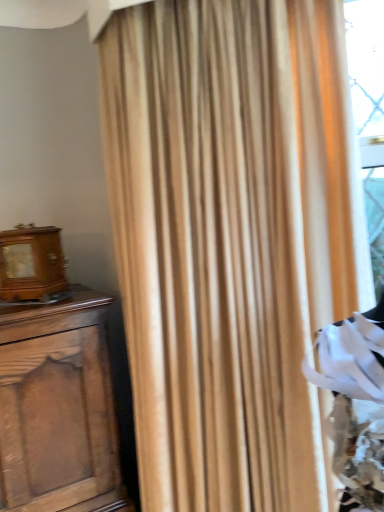
Identify the location of wooden alarm clock at left. The image size is (384, 512). (31, 264).

Image resolution: width=384 pixels, height=512 pixels. What do you see at coordinates (31, 264) in the screenshot?
I see `wooden alarm clock at left` at bounding box center [31, 264].

At what (x,y) coordinates should I click in order to perform the action: click on matte beige curtain at center. Please return your answer as a coordinate pair (x, y). Looking at the image, I should click on (226, 241).

What do you see at coordinates (226, 241) in the screenshot? Image resolution: width=384 pixels, height=512 pixels. I see `matte beige curtain at center` at bounding box center [226, 241].

The image size is (384, 512). I want to click on wooden alarm clock at left, so (31, 264).

Is wooden alarm clock at left to the left of matte beige curtain at center from the viewer's perspective?

Indeed, wooden alarm clock at left is positioned on the left side of matte beige curtain at center.

Who is more distant, wooden alarm clock at left or matte beige curtain at center?

wooden alarm clock at left.

Does point (54, 288) come behind point (182, 302)?

Yes, it is.

From the image's perspective, is wooden alarm clock at left beneath matte beige curtain at center?

No, from the image's perspective, wooden alarm clock at left is not beneath matte beige curtain at center.

From a real-world perspective, is wooden alarm clock at left on matte beige curtain at center?

Yes, from a real-world perspective, wooden alarm clock at left is above matte beige curtain at center.

Which of these two, wooden alarm clock at left or matte beige curtain at center, is thinner?

wooden alarm clock at left is thinner.

From the picture: Does wooden alarm clock at left have a greater height compared to matte beige curtain at center?

No.

Considering the relative sizes of wooden alarm clock at left and matte beige curtain at center in the image provided, is wooden alarm clock at left bigger than matte beige curtain at center?

No, wooden alarm clock at left is not bigger than matte beige curtain at center.

Can we say wooden alarm clock at left lies outside matte beige curtain at center?

Yes, wooden alarm clock at left is located beyond the bounds of matte beige curtain at center.

Consider the image. Are wooden alarm clock at left and matte beige curtain at center far apart?

No, there isn't a large distance between wooden alarm clock at left and matte beige curtain at center.

Is wooden alarm clock at left turned away from matte beige curtain at center?

That's not correct — wooden alarm clock at left is not looking away from matte beige curtain at center.

How different are the orientations of wooden alarm clock at left and matte beige curtain at center in degrees?

3.17 degrees.

At what (x,y) coordinates should I click in order to perform the action: click on alarm clock behind the matte beige curtain at center. Please return your answer as a coordinate pair (x, y). The height and width of the screenshot is (512, 384). Looking at the image, I should click on (31, 264).

Which is more to the left, matte beige curtain at center or wooden alarm clock at left?

wooden alarm clock at left.

Is matte beige curtain at center in front of wooden alarm clock at left?

Yes, matte beige curtain at center is in front of wooden alarm clock at left.

Is point (111, 25) in front of point (32, 248)?

Yes.

From the image's perspective, which one is positioned higher, matte beige curtain at center or wooden alarm clock at left?

wooden alarm clock at left is shown above in the image.

From a real-world perspective, between matte beige curtain at center and wooden alarm clock at left, who is vertically higher?

From a 3D spatial view, wooden alarm clock at left is above.

Considering the sizes of objects matte beige curtain at center and wooden alarm clock at left in the image provided, who is thinner, matte beige curtain at center or wooden alarm clock at left?

With smaller width is wooden alarm clock at left.

Considering the sizes of objects matte beige curtain at center and wooden alarm clock at left in the image provided, who is taller, matte beige curtain at center or wooden alarm clock at left?

With more height is matte beige curtain at center.

Can you confirm if matte beige curtain at center is bigger than wooden alarm clock at left?

Yes, matte beige curtain at center is bigger than wooden alarm clock at left.

Would you say matte beige curtain at center is inside or outside wooden alarm clock at left?

The correct answer is: outside.

Is matte beige curtain at center far from wooden alarm clock at left?

No, matte beige curtain at center is not far from wooden alarm clock at left.

Consider the image. Is matte beige curtain at center looking in the opposite direction of wooden alarm clock at left?

matte beige curtain at center is not turned away from wooden alarm clock at left.

The height and width of the screenshot is (512, 384). Find the location of `alarm clock above the matte beige curtain at center (from the image's perspective)`. alarm clock above the matte beige curtain at center (from the image's perspective) is located at coordinates (31, 264).

This screenshot has height=512, width=384. What are the coordinates of `alarm clock lying on the left of matte beige curtain at center` in the screenshot? It's located at (31, 264).

In the image, there is a wooden alarm clock at left. What are the coordinates of `curtain below it (from a real-world perspective)` in the screenshot? It's located at (226, 241).